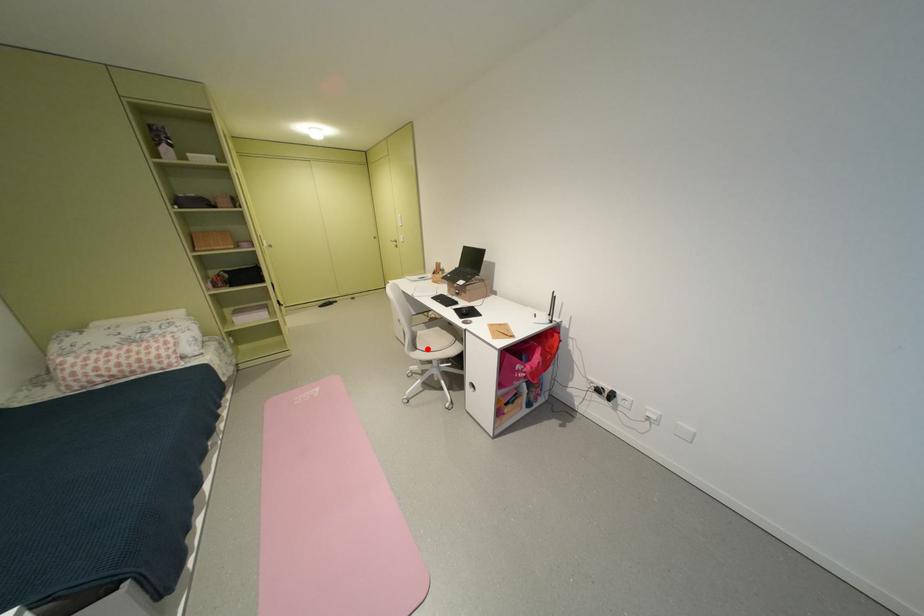
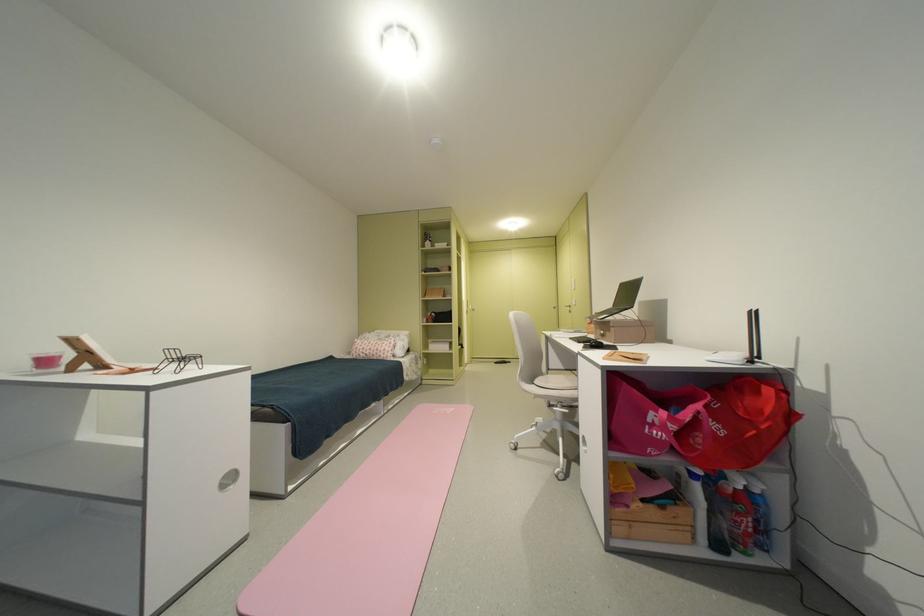
Find the pixel in the second image that matches the highlighted location in the first image.

(543, 383)